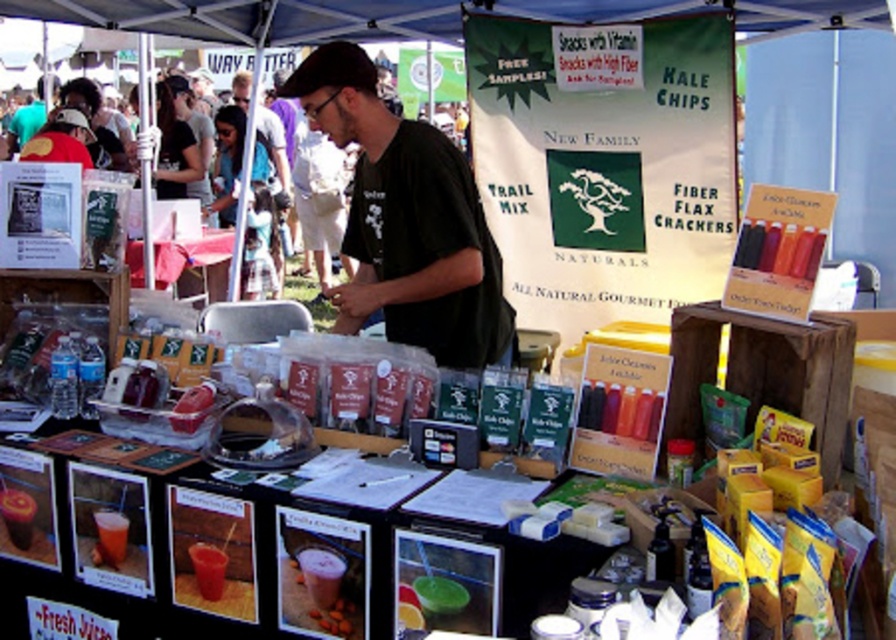
You are a customer standing at the entrance of the market stall. You want to pick up an item from the black matte shirt at center and then place it on the matte plastic table at center. Is the distance between them sufficient for you to comfortably carry the item without needing to adjust your grip?

The distance between the black matte shirt at center and the matte plastic table at center is 10.93 feet. Since this is a reasonable distance for carrying an item, you can comfortably carry the item without needing to adjust your grip.

You are standing at the vendor stall and want to pick up an item. Which of the two points, point (373, 262) or point (205, 285), is closer to you?

Point (373, 262) is closer to the camera than point (205, 285), so it is closer to you.